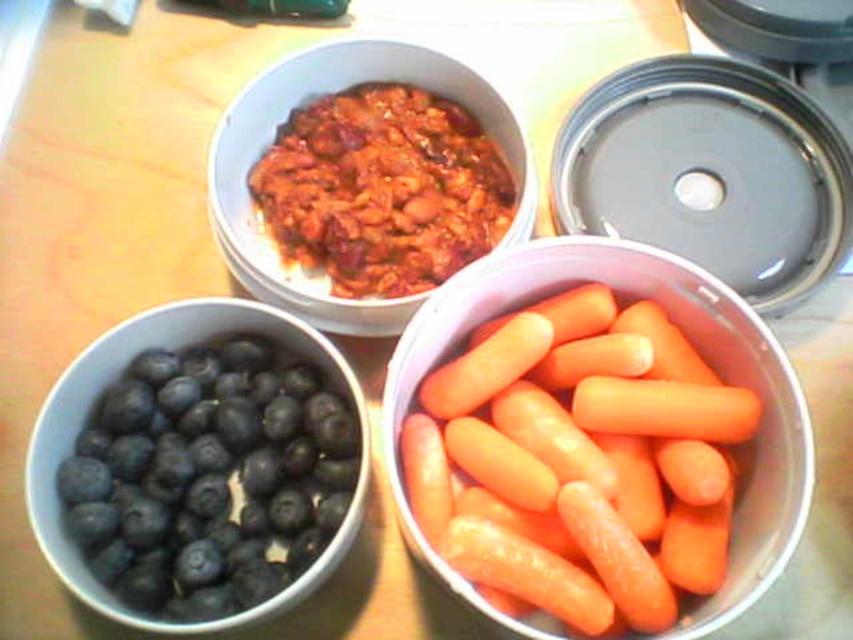
Who is more forward, (129, 483) or (527, 209)?

Point (129, 483)

Which of these two, blue matte/blackberry at lower left or matte ceramic chili at upper center, stands shorter?

blue matte/blackberry at lower left

The height and width of the screenshot is (640, 853). Describe the element at coordinates (210, 476) in the screenshot. I see `blue matte/blackberry at lower left` at that location.

This screenshot has width=853, height=640. What are the coordinates of `blue matte/blackberry at lower left` in the screenshot? It's located at coord(210,476).

Is point (215, 611) closer to viewer compared to point (566, 237)?

Yes, point (215, 611) is closer to viewer.

Is blue matte/blackberry at lower left to the right of orange glossy carrots at center from the viewer's perspective?

No, blue matte/blackberry at lower left is not to the right of orange glossy carrots at center.

At what (x,y) coordinates should I click in order to perform the action: click on blue matte/blackberry at lower left. Please return your answer as a coordinate pair (x, y). This screenshot has width=853, height=640. Looking at the image, I should click on (210, 476).

Identify the location of blue matte/blackberry at lower left. This screenshot has width=853, height=640. (210, 476).

Which is behind, point (714, 291) or point (526, 188)?

The point (526, 188) is behind.

Which is more to the right, orange glossy carrots at center or matte ceramic chili at upper center?

Positioned to the right is orange glossy carrots at center.

At what (x,y) coordinates should I click in order to perform the action: click on orange glossy carrots at center. Please return your answer as a coordinate pair (x, y). Looking at the image, I should click on (699, 352).